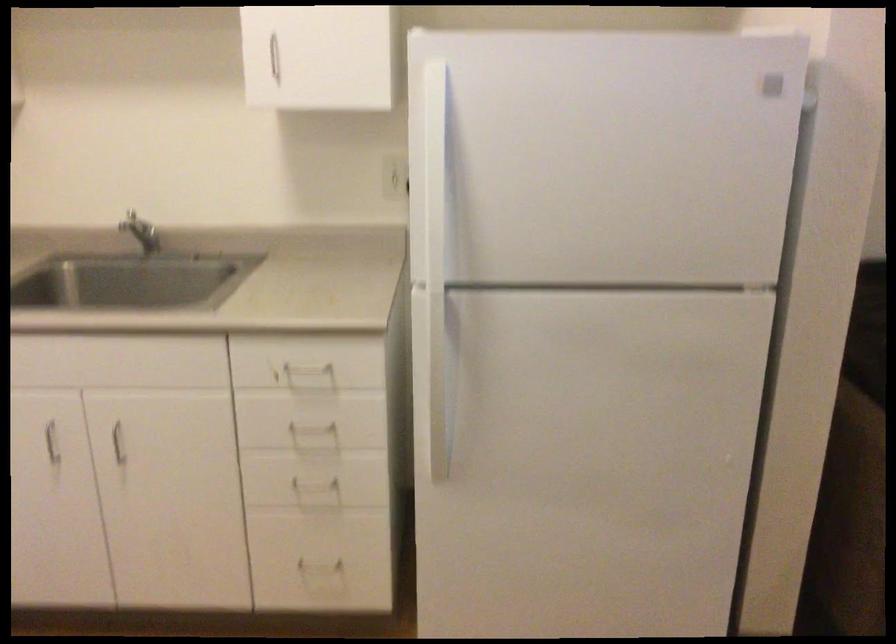
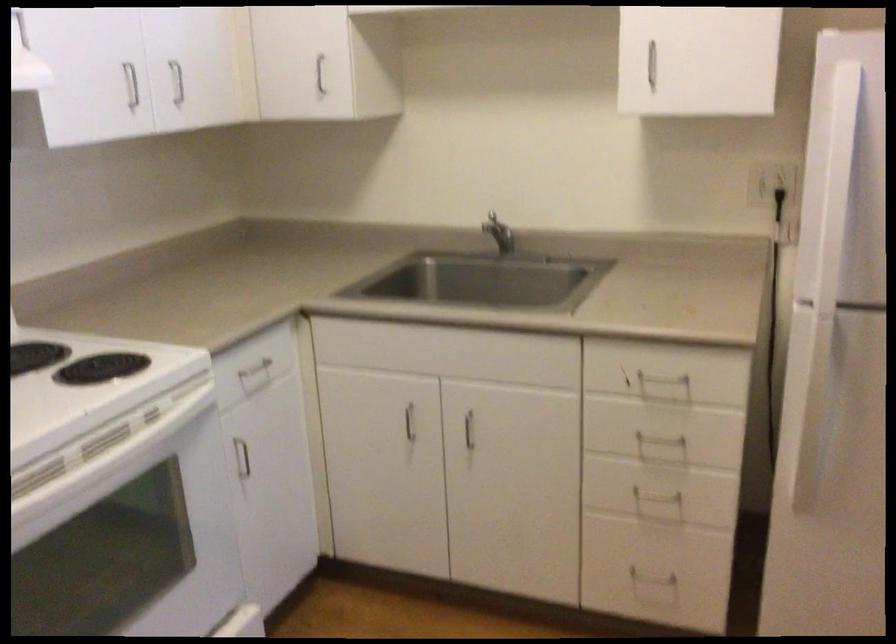
In the second image, find the point that corresponds to pixel 425 223 in the first image.

(831, 240)